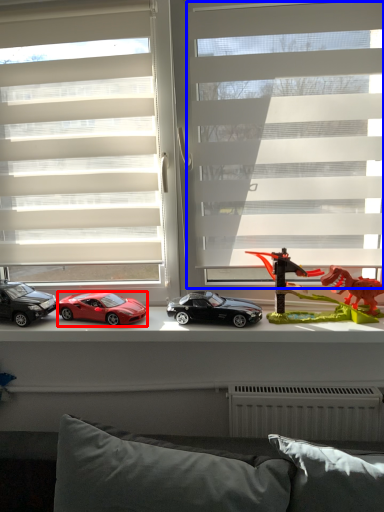
Question: Among these objects, which one is farthest to the camera, car (highlighted by a red box) or bay window (highlighted by a blue box)?

Choices:
 (A) car
 (B) bay window

Answer: (A)